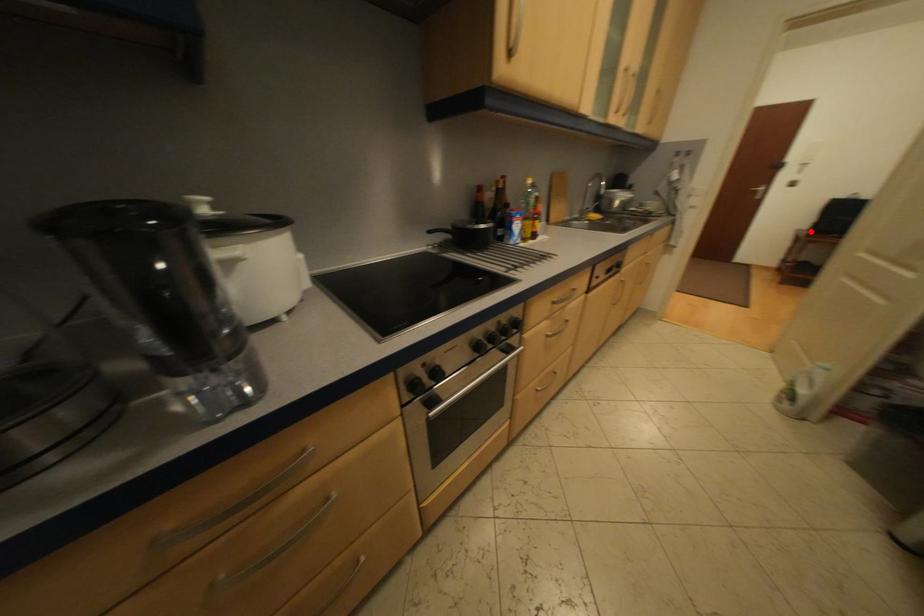
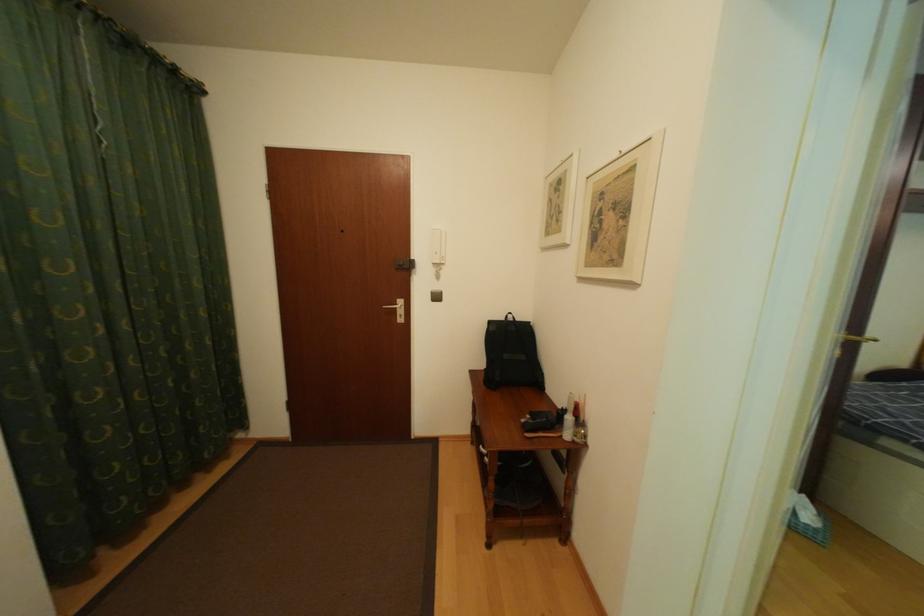
Question: I am providing you with two images of the same scene from different viewpoints. Image1 has a red point marked. In image2, the corresponding 3D location appears at what relative position? Reply with the corresponding letter.

Choices:
 (A) Closer
 (B) Farther

Answer: (B)